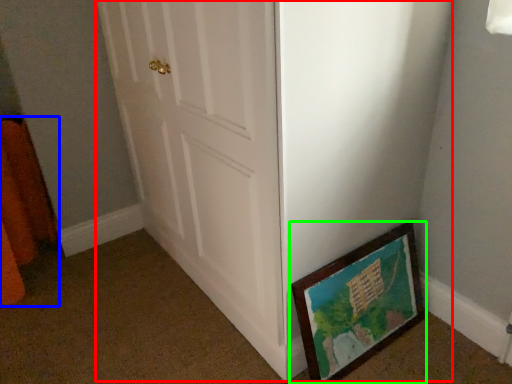
Question: Based on their relative distances, which object is nearer to door (highlighted by a red box)? Choose from curtain (highlighted by a blue box) and picture frame (highlighted by a green box).

Choices:
 (A) curtain
 (B) picture frame

Answer: (B)